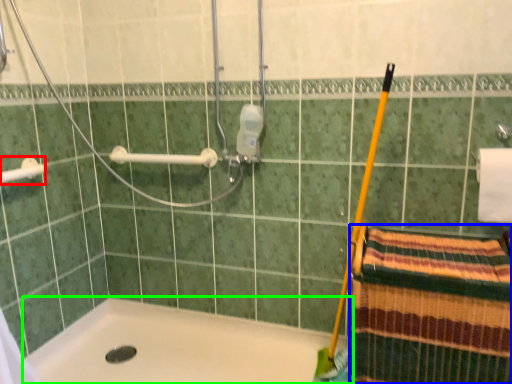
Question: Considering the real-world distances, which object is farthest from towel bar (highlighted by a red box)? beach towel (highlighted by a blue box) or bathtub (highlighted by a green box)?

Choices:
 (A) beach towel
 (B) bathtub

Answer: (A)